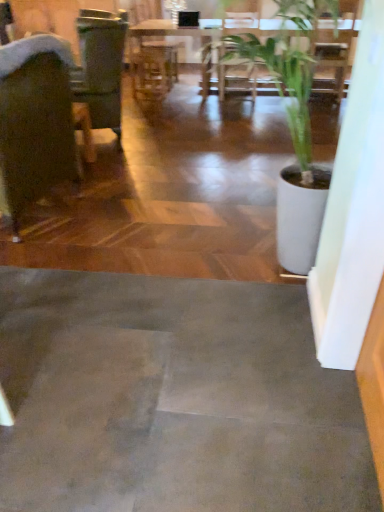
Question: From the image's perspective, is green leafy plant at upper center positioned above or below dark brown leather chair at left?

Choices:
 (A) above
 (B) below

Answer: (A)

Question: From their relative heights in the image, would you say green leafy plant at upper center is taller or shorter than dark brown leather chair at left?

Choices:
 (A) short
 (B) tall

Answer: (A)

Question: In the image, is green leafy plant at upper center on the left side or the right side of dark brown leather chair at left?

Choices:
 (A) right
 (B) left

Answer: (A)

Question: Based on their sizes in the image, would you say dark brown leather chair at left is bigger or smaller than green leafy plant at upper center?

Choices:
 (A) big
 (B) small

Answer: (B)

Question: Based on their positions, is dark brown leather chair at left located to the left or right of green leafy plant at upper center?

Choices:
 (A) right
 (B) left

Answer: (B)

Question: Looking at their shapes, would you say dark brown leather chair at left is wider or thinner than green leafy plant at upper center?

Choices:
 (A) wide
 (B) thin

Answer: (B)

Question: Is dark brown leather chair at left inside the boundaries of green leafy plant at upper center, or outside?

Choices:
 (A) inside
 (B) outside

Answer: (B)